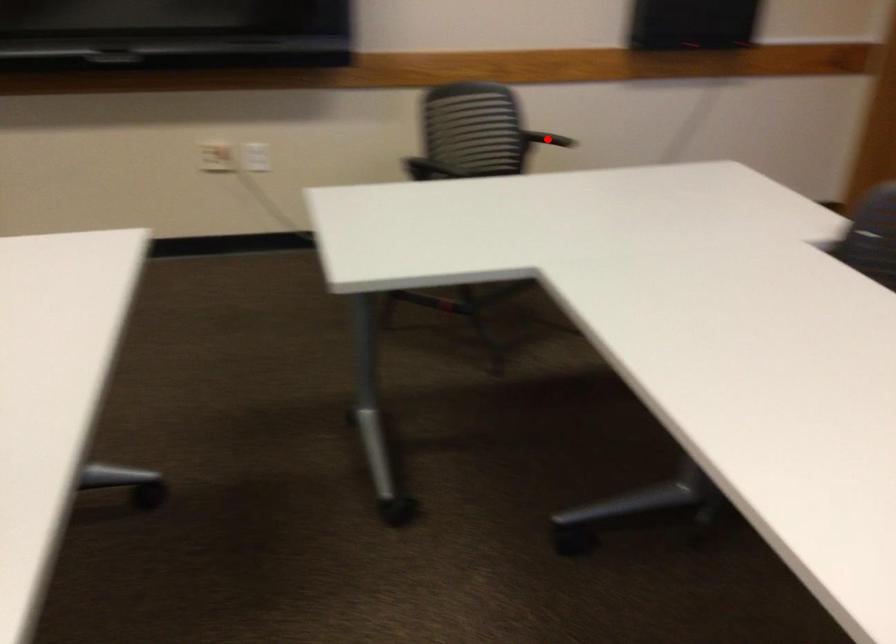
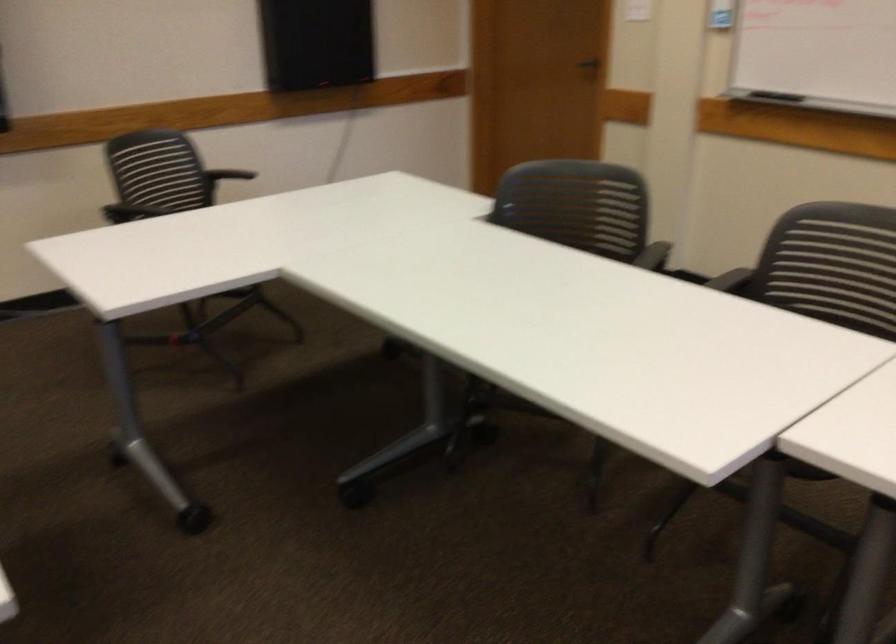
Question: I am providing you with two images of the same scene from different viewpoints. A red point is marked on the first image. At the location where the point appears in image 1, is it still visible in image 2?

Choices:
 (A) Yes
 (B) No

Answer: (B)